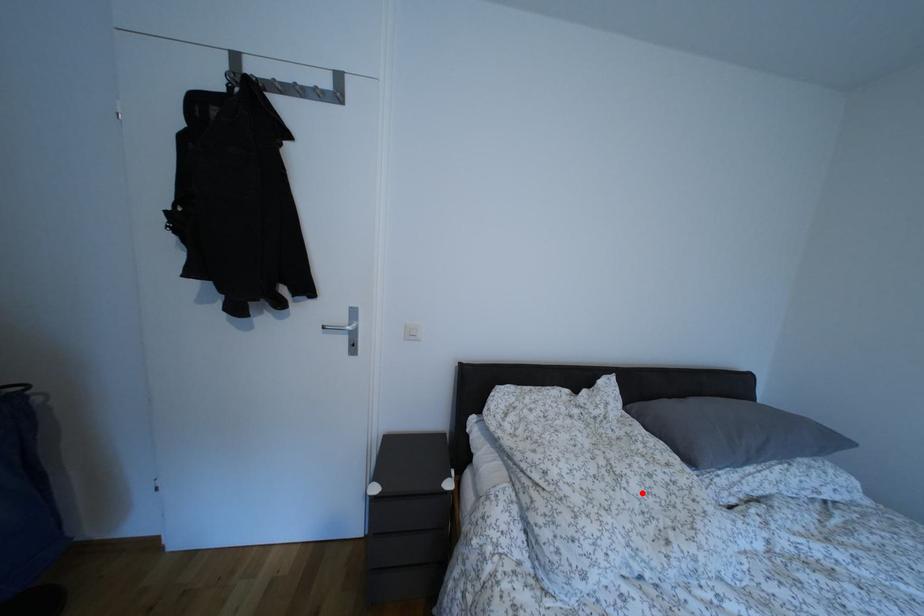
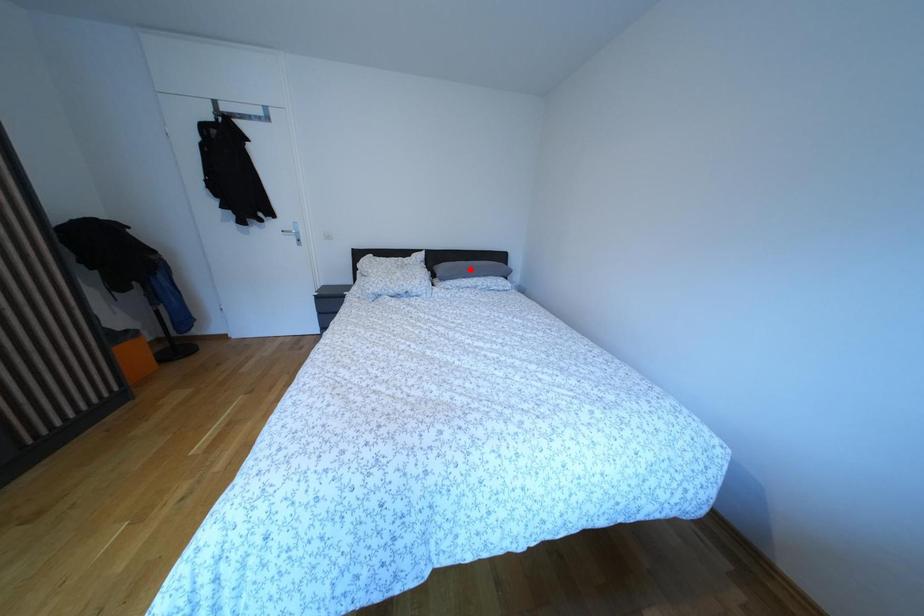
I am providing you with two images of the same scene from different viewpoints. A red point is marked on the first image and another point is marked on the second image. Does the point marked in image1 correspond to the same location as the one in image2?

No